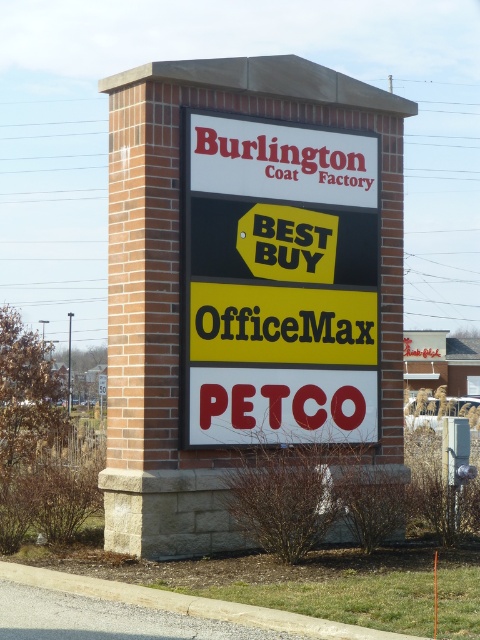
You are a delivery person who needs to place a new sign that is 6 inches wide between the brick sign at center and the white plastic sign at center. Is there enough space between them to fit the new sign?

The distance between the brick sign at center and the white plastic sign at center is 5.22 inches. Since the new sign is 6 inches wide, which is wider than the available space, it will not fit between them.

You are standing in front of the multi tiered signpost described. You see the brick sign at center and the white plastic sign at center. Which one is positioned to the left?

The brick sign at center is to the left of the white plastic sign at center.